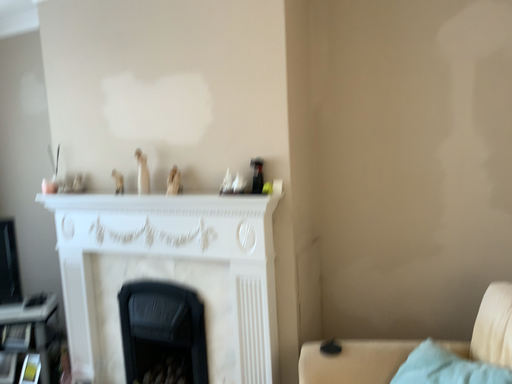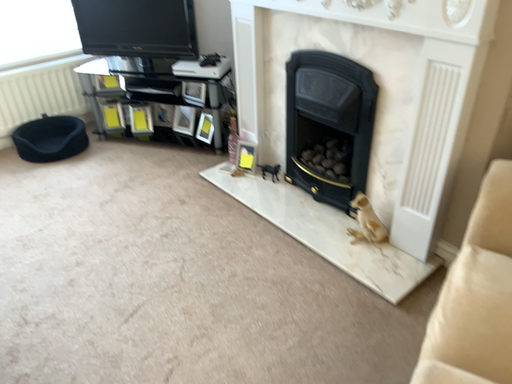
Question: How did the camera likely rotate when shooting the video?

Choices:
 (A) rotated left
 (B) rotated right

Answer: (A)